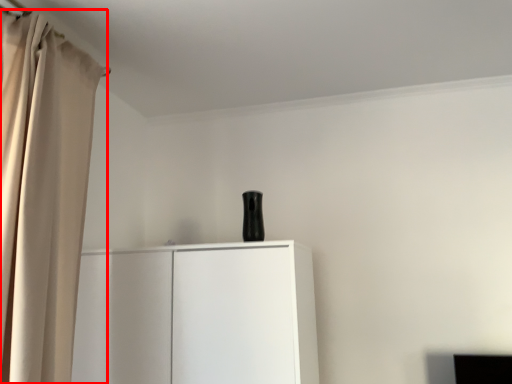
Question: Where is curtain (annotated by the red box) located in relation to cupboard in the image?

Choices:
 (A) right
 (B) left

Answer: (B)